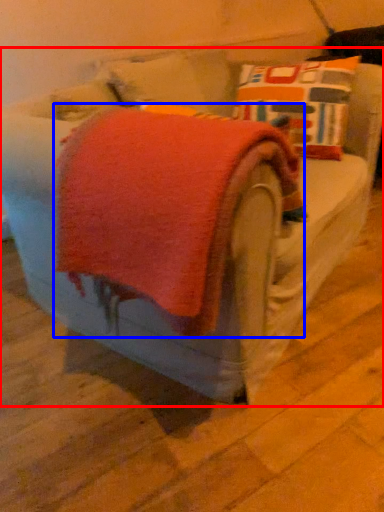
Question: Among these objects, which one is nearest to the camera, furniture (highlighted by a red box) or bath towel (highlighted by a blue box)?

Choices:
 (A) furniture
 (B) bath towel

Answer: (A)